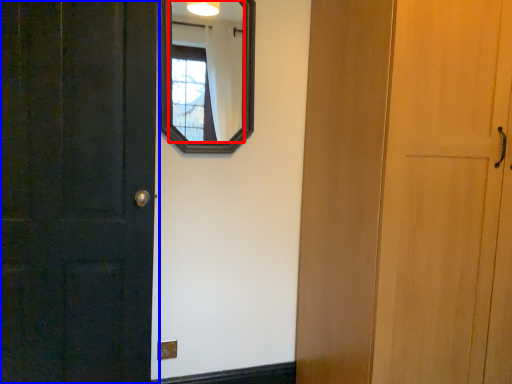
Question: Which of the following is the closest to the observer, mirror (highlighted by a red box) or door (highlighted by a blue box)?

Choices:
 (A) mirror
 (B) door

Answer: (B)